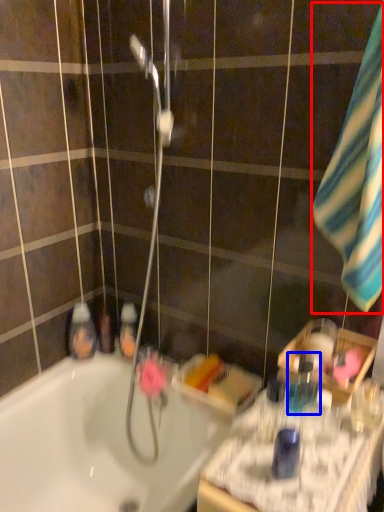
Question: Which object is further to the camera taking this photo, beach towel (highlighted by a red box) or mouthwash (highlighted by a blue box)?

Choices:
 (A) beach towel
 (B) mouthwash

Answer: (B)